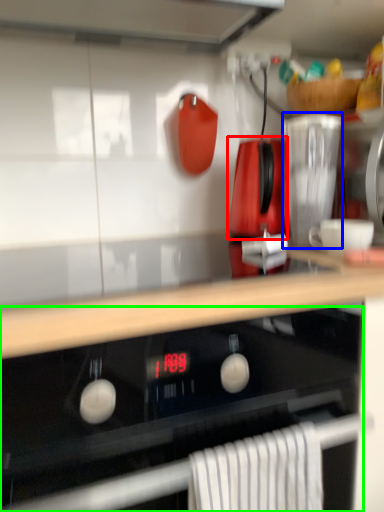
Question: Which object is the farthest from kitchen appliance (highlighted by a red box)? Choose among these: kitchen appliance (highlighted by a blue box) or oven (highlighted by a green box).

Choices:
 (A) kitchen appliance
 (B) oven

Answer: (B)